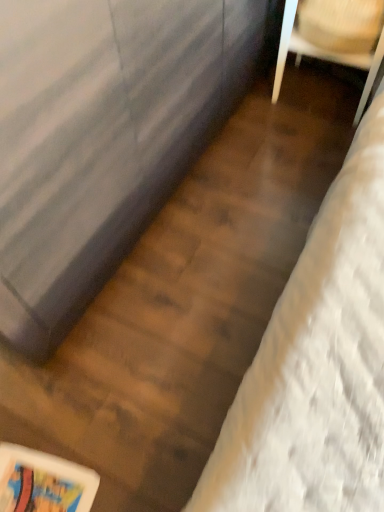
What are the coordinates of `wooden chair at upper right` in the screenshot? It's located at (307, 49).

Measure the distance between wooden chair at upper right and camera.

4.54 feet.

Measure the distance between point [273,87] and camera.

1.84 meters.

The height and width of the screenshot is (512, 384). What do you see at coordinates (307, 49) in the screenshot?
I see `wooden chair at upper right` at bounding box center [307, 49].

The height and width of the screenshot is (512, 384). I want to click on wooden chair at upper right, so tap(307, 49).